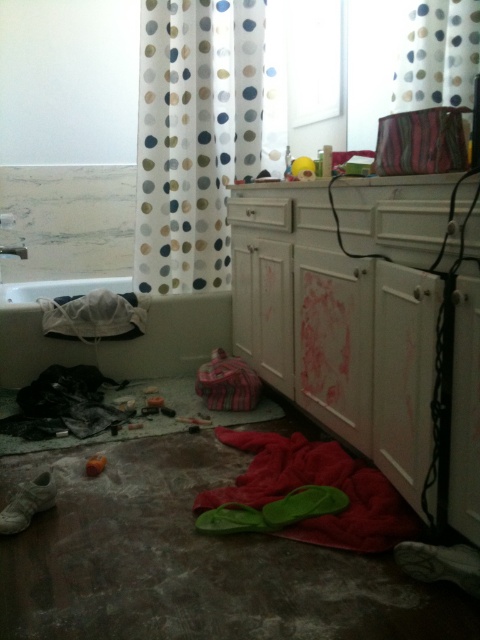
Can you confirm if white glossy vanity at lower right is positioned to the right of white dotted fabric at upper center?

In fact, white glossy vanity at lower right is to the left of white dotted fabric at upper center.

Does point (324, 227) come in front of point (415, 72)?

Yes, it is.

The width and height of the screenshot is (480, 640). Find the location of `white glossy vanity at lower right`. white glossy vanity at lower right is located at coordinates (359, 307).

In order to click on white glossy vanity at lower right in this screenshot , I will do `click(359, 307)`.

Who is lower down, white fabric at lower left or white dotted fabric at upper center?

white fabric at lower left is below.

Is white fabric at lower left below white dotted fabric at upper center?

Yes.

Who is more forward, (227, 326) or (411, 20)?

Point (411, 20) is in front.

Find the location of a particular element. This screenshot has height=640, width=480. white fabric at lower left is located at coordinates (120, 340).

Can you confirm if polka dot fabric shower curtain at upper center is positioned to the right of white fabric at lower left?

Correct, you'll find polka dot fabric shower curtain at upper center to the right of white fabric at lower left.

Measure the distance between point [228,61] and camera.

Point [228,61] is 9.48 feet from camera.

The width and height of the screenshot is (480, 640). Identify the location of polka dot fabric shower curtain at upper center. (193, 134).